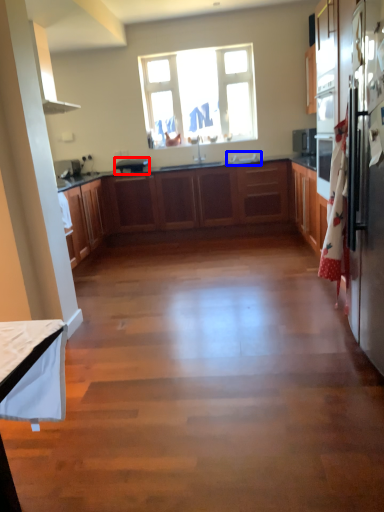
Question: Which point is closer to the camera, appliance (highlighted by a red box) or sink (highlighted by a blue box)?

Choices:
 (A) appliance
 (B) sink

Answer: (B)